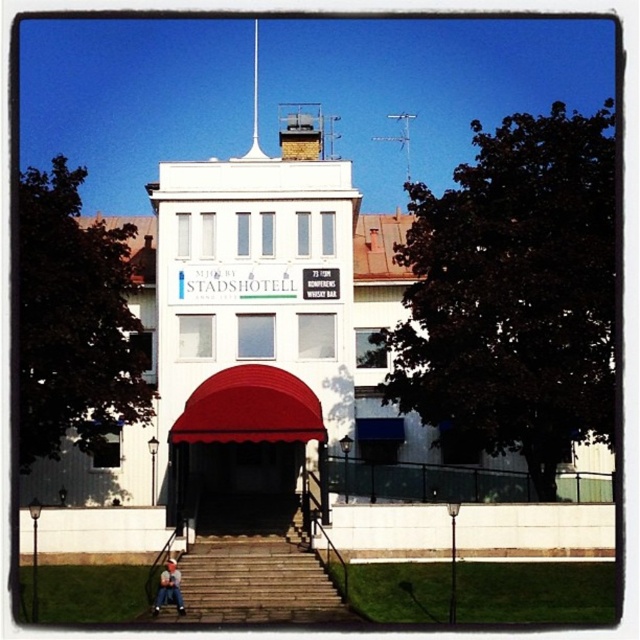
You are a person wearing the blue denim jeans at lower center and want to climb the stone stairs at center. Can you fit through the staircase without any issues?

The stone stairs at center might be wider than blue denim jeans at lower center, so it is likely possible to climb them without any issues.

You are standing at the entrance of the STADSHOTELL building and see the stone stairs at center and the blue denim jeans at lower center. Which object is closer to you?

The stone stairs at center is closer to you because it is in front of the blue denim jeans at lower center.

You are standing in front of the two story building and want to enter. You see the red fabric awning at center and the blue denim jeans at lower center. Which object is closer to you?

The red fabric awning at center is closer to you because the blue denim jeans at lower center is behind it.